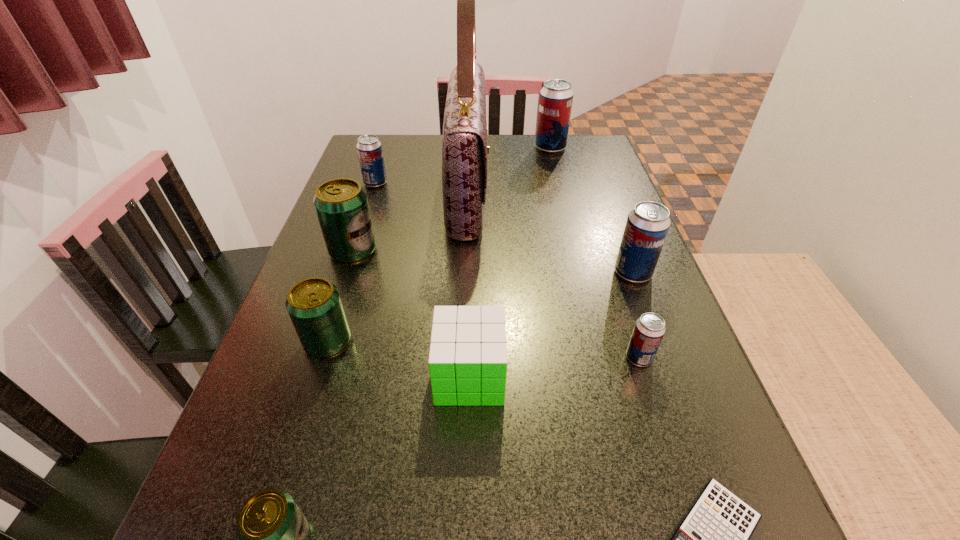
I want to click on the smallest red beer can, so click(x=648, y=332).

Where is `vacant area situated 0.090m on the front of the handbag with the clasp`? This screenshot has height=540, width=960. vacant area situated 0.090m on the front of the handbag with the clasp is located at coordinates (521, 192).

Find the location of `vacant space located on the left of the farthest red beer can`. vacant space located on the left of the farthest red beer can is located at coordinates (472, 148).

In order to click on free space located 0.250m on the front of the second nearest red beer can in this screenshot , I will do `click(676, 387)`.

Where is `vacant space located 0.270m on the right of the biggest green beer can`? vacant space located 0.270m on the right of the biggest green beer can is located at coordinates (493, 251).

Identify the location of vacant space located on the front of the leftmost red beer can. (361, 228).

Find the location of a particular element. The width and height of the screenshot is (960, 540). blank space located on the right of the second smallest green beer can is located at coordinates (447, 342).

The height and width of the screenshot is (540, 960). In order to click on free region located on the left of the cube in this screenshot , I will do `click(276, 376)`.

The image size is (960, 540). I want to click on vacant space situated 0.150m on the front of the smallest red beer can, so click(x=669, y=450).

You are a GUI agent. You are given a task and a screenshot of the screen. Output one action in this format:
    pyautogui.click(x=<x>, y=<y>)
    Task: Click on the handbag present at the far edge
    
    Given the screenshot: What is the action you would take?
    pyautogui.click(x=464, y=144)